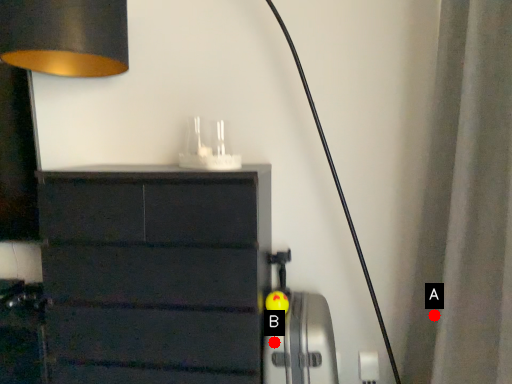
Question: Two points are circled on the image, labeled by A and B beside each circle. Which point appears farthest from the camera in this image?

Choices:
 (A) A is further
 (B) B is further

Answer: (A)